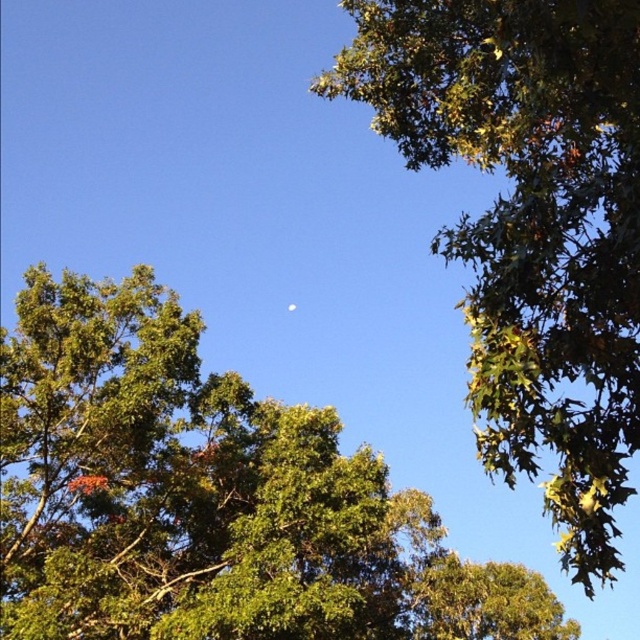
You are standing in the middle of the forest looking up at the trees. Which tree is closer to the sky, the green leafy tree at center or the green leafy tree at upper right?

The green leafy tree at upper right is closer to the sky because the green leafy tree at center is positioned under it.

You are an astronomer observing the night sky. You notice the green leafy tree at upper right and the white glossy moon at center. Which object is positioned to the right side of the other?

The green leafy tree at upper right is positioned to the right of the white glossy moon at center.

You are standing in the middle of a forest and see the green leafy tree at center and the green leafy tree at upper right. Which tree would block your view of the sky more if you look straight ahead?

The green leafy tree at center would block your view of the sky more because it is larger in size than the green leafy tree at upper right.